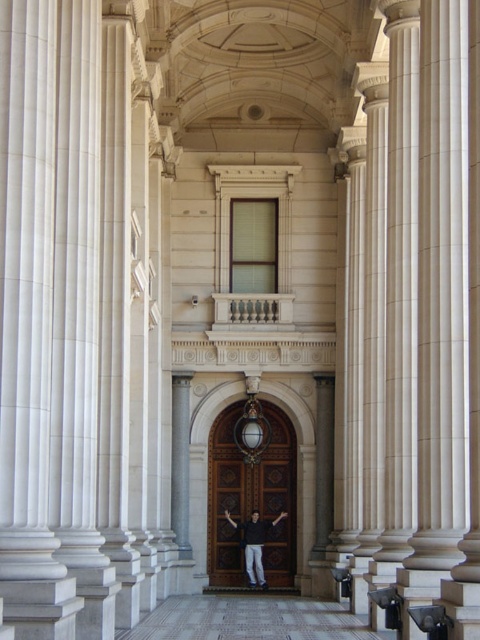
Looking at this image, you are standing at the entrance of the grand architectural structure and notice two points marked in the scene. The first point is at coordinates point (266, 410) and the second is at point (261, 566). Which of these two points is closer to your current position?

Point (266, 410) is further to the camera than point (261, 566), so the point closer to your position is point (261, 566).

You are standing in front of the grand entrance and notice both the polished wood door at center and the dark gray shirt at center. Which object is closer to you?

The polished wood door at center is closer to you than the dark gray shirt at center.